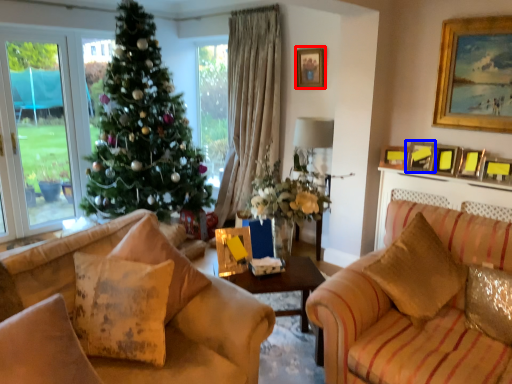
Question: Which object appears farthest to the camera in this image, picture frame (highlighted by a red box) or picture frame (highlighted by a blue box)?

Choices:
 (A) picture frame
 (B) picture frame

Answer: (A)